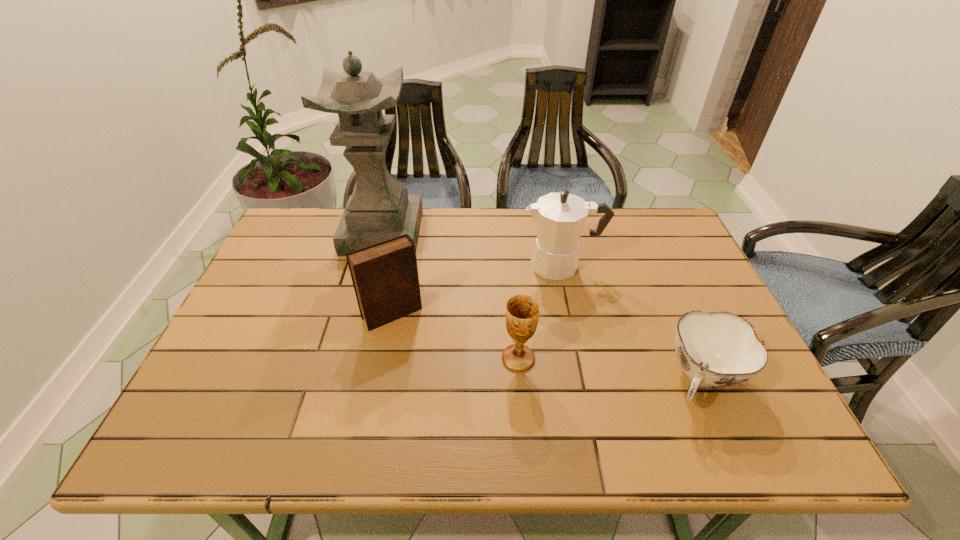
Locate an element on the screen. unoccupied position between the coffeepot and the tallest object is located at coordinates (472, 248).

Identify the location of free space between the Bible and the rightmost object. (547, 347).

Select which object is the fourth closest to the shortest object. Please provide its 2D coordinates. Your answer should be formatted as a tuple, i.e. [(x, y)], where the tuple contains the x and y coordinates of a point satisfying the conditions above.

[(379, 209)]

Identify the location of the closest object to the coffeepot. Image resolution: width=960 pixels, height=540 pixels. (522, 311).

In order to click on vacant space that satisfies the following two spatial constraints: 1. at the front opening of the tallest object; 2. on the right side of the chinaware in this screenshot , I will do `click(344, 379)`.

At what (x,y) coordinates should I click in order to perform the action: click on vacant region that satisfies the following two spatial constraints: 1. at the front opening of the tallest object; 2. on the left side of the Bible. Please return your answer as a coordinate pair (x, y). Looking at the image, I should click on (361, 314).

What are the coordinates of `free space that satisfies the following two spatial constraints: 1. on the front side of the fourth tallest object; 2. on the right side of the rightmost object` in the screenshot? It's located at (520, 379).

Where is `free location that satisfies the following two spatial constraints: 1. at the spout of the coffeepot; 2. on the right side of the chinaware`? The height and width of the screenshot is (540, 960). free location that satisfies the following two spatial constraints: 1. at the spout of the coffeepot; 2. on the right side of the chinaware is located at coordinates (585, 379).

Find the location of a particular element. This screenshot has height=540, width=960. vacant space that satisfies the following two spatial constraints: 1. at the spout of the coffeepot; 2. on the right side of the rightmost object is located at coordinates (585, 379).

This screenshot has width=960, height=540. I want to click on vacant region that satisfies the following two spatial constraints: 1. at the spout of the coffeepot; 2. on the left side of the shortest object, so click(585, 379).